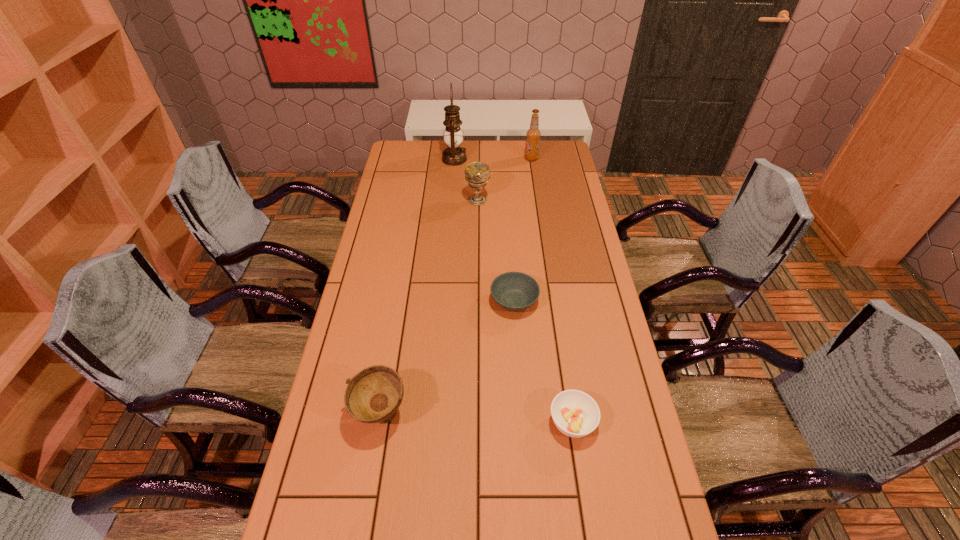
Find the location of `vacant space positioned on the front label of the fifth shortest object`. vacant space positioned on the front label of the fifth shortest object is located at coordinates (499, 158).

Where is `free space located on the front of the third farthest object`? This screenshot has width=960, height=540. free space located on the front of the third farthest object is located at coordinates (477, 220).

Where is `blank space located 0.100m on the front of the leftmost object`? blank space located 0.100m on the front of the leftmost object is located at coordinates pyautogui.click(x=370, y=482).

Where is `vacant region located on the right of the farthest soup bowl`? This screenshot has height=540, width=960. vacant region located on the right of the farthest soup bowl is located at coordinates 603,301.

Where is `oil lamp positioned at the far edge`? The width and height of the screenshot is (960, 540). oil lamp positioned at the far edge is located at coordinates (x=454, y=155).

Where is `beer bottle located in the far edge section of the desktop`? beer bottle located in the far edge section of the desktop is located at coordinates (533, 134).

I want to click on object present at the left edge, so (x=374, y=394).

Image resolution: width=960 pixels, height=540 pixels. I want to click on beer bottle that is at the right edge, so click(533, 134).

What are the coordinates of `soup bowl that is positioned at the right edge` in the screenshot? It's located at (576, 414).

Identify the location of object positioned at the far right corner. (533, 134).